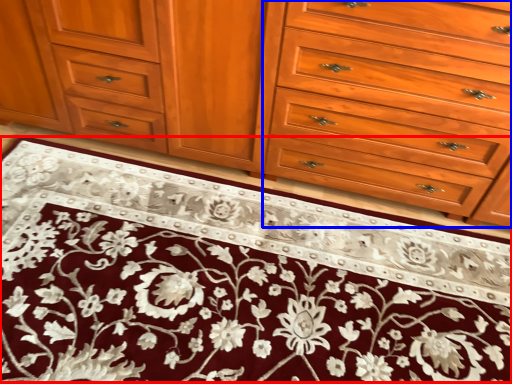
Question: Among these objects, which one is farthest to the camera, doormat (highlighted by a red box) or drawer (highlighted by a blue box)?

Choices:
 (A) doormat
 (B) drawer

Answer: (B)